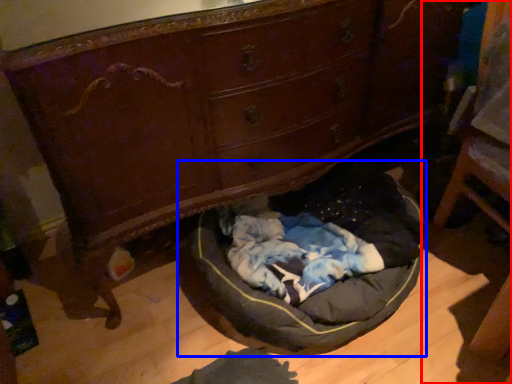
Question: Which of the following is the closest to the observer, furniture (highlighted by a red box) or dog bed (highlighted by a blue box)?

Choices:
 (A) furniture
 (B) dog bed

Answer: (A)